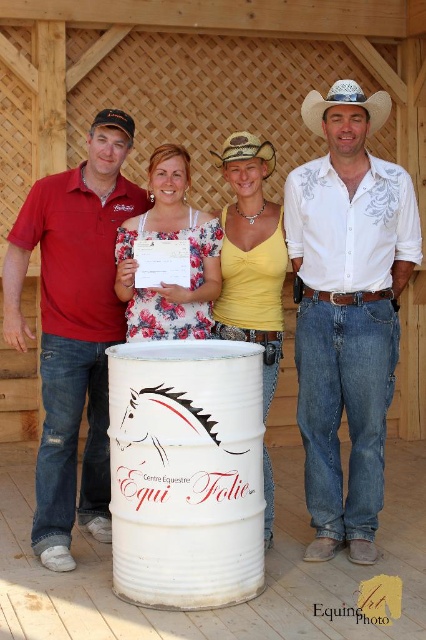
Based on the photo, you are a photographer taking a group photo of the matte red polo shirt at left and the yellow matte tank top at center. Which person should you adjust to ensure both are in focus? Explain your reasoning.

The matte red polo shirt at left is taller than the yellow matte tank top at center. To ensure both are in focus, adjust the camera angle so that both are at the same focal plane. Since the matte red polo shirt at left is taller, lower the camera slightly or have the taller individual crouch slightly to align their heights.

You are a photographer setting up a camera to capture the group. The matte red polo shirt at left and the yellow matte tank top at center are two focal points. Based on their positions, which one is positioned more to the left side of the group?

The matte red polo shirt at left is positioned more to the left side of the group than the yellow matte tank top at center.

You are standing in front of the wooden lattice structure and want to find the person wearing the matte red polo shirt at left. Based on the coordinates provided, where should you look relative to the group?

The matte red polo shirt at left is located at coordinates point [74,326], which is on the left side of the group.